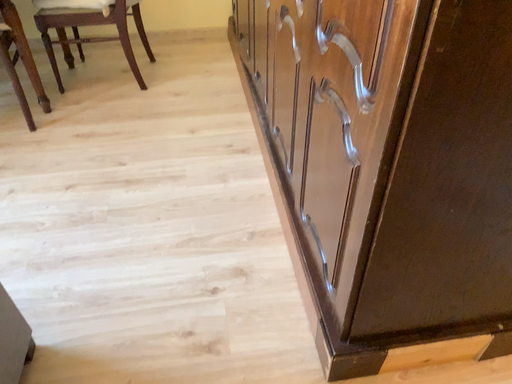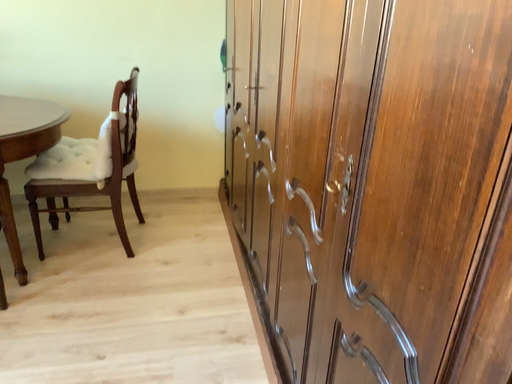
Question: How did the camera likely rotate when shooting the video?

Choices:
 (A) rotated downward
 (B) rotated upward

Answer: (B)